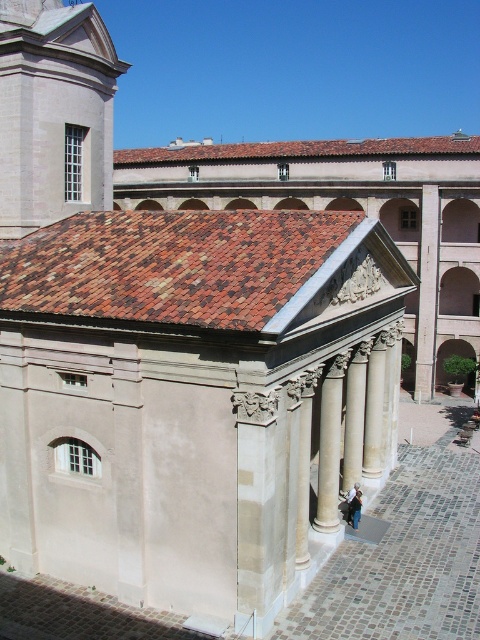
Question: Is smooth stone tower at upper left further to the viewer compared to white marble pillar at center?

Choices:
 (A) no
 (B) yes

Answer: (B)

Question: Which point is closer to the camera?

Choices:
 (A) (85, 122)
 (B) (431, 275)
 (C) (332, 392)

Answer: (C)

Question: Can you confirm if smooth stone tower at upper left is positioned to the left of smooth stone column at right?

Choices:
 (A) no
 (B) yes

Answer: (B)

Question: Estimate the real-world distances between objects in this image. Which object is closer to the smooth stone tower at upper left?

Choices:
 (A) white marble pillar at center
 (B) white marble column at center

Answer: (B)

Question: Is smooth stone tower at upper left to the right of smooth stone column at right from the viewer's perspective?

Choices:
 (A) no
 (B) yes

Answer: (A)

Question: Which point is farther to the camera?

Choices:
 (A) white marble pillar at center
 (B) smooth stone tower at upper left
 (C) smooth stone column at right
 (D) white marble column at center

Answer: (C)